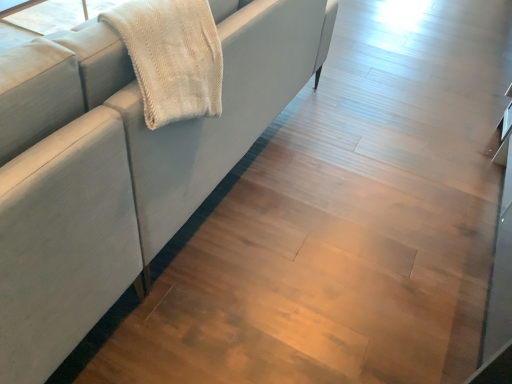
Based on the photo, in order to face textured gray couch at center, should I rotate leftwards or rightwards?

Rotate left and turn 10.450 degrees.

What is the approximate width of textured gray couch at center?

textured gray couch at center is 1.02 meters in width.

What do you see at coordinates (121, 166) in the screenshot?
I see `textured gray couch at center` at bounding box center [121, 166].

Identify the location of textured gray couch at center. (121, 166).

Locate an element on the screen. The image size is (512, 384). textured gray couch at center is located at coordinates (121, 166).